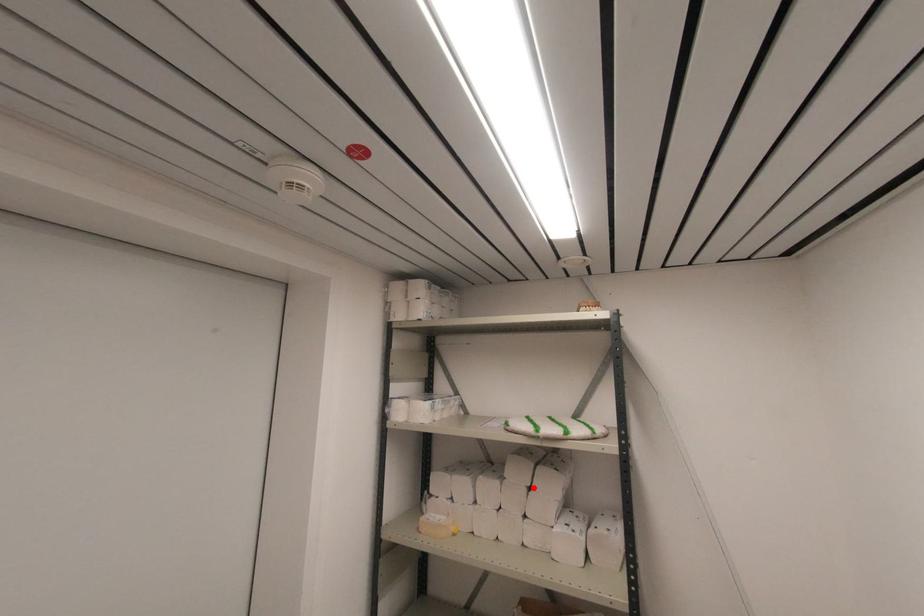
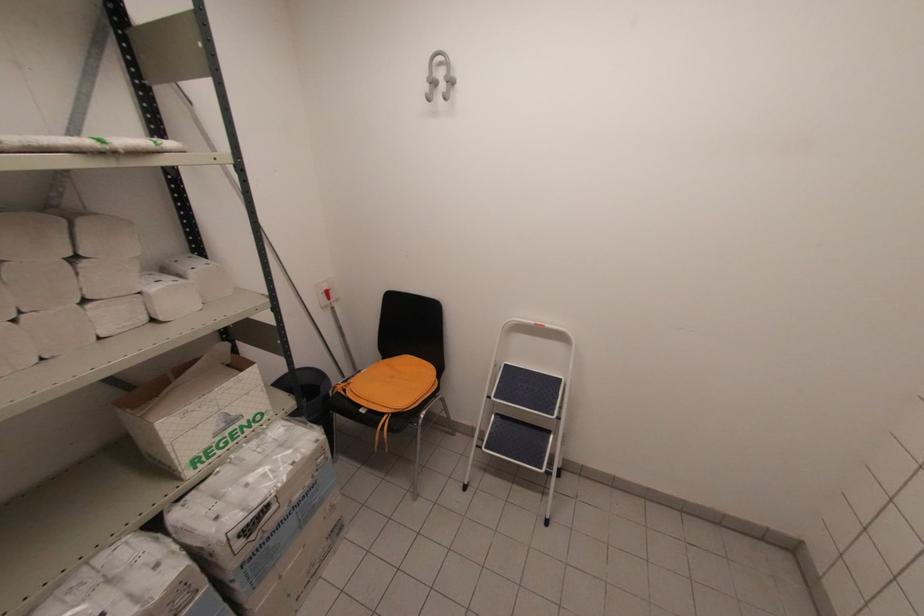
Find the pixel in the second image that matches the highlighted location in the first image.

(81, 254)